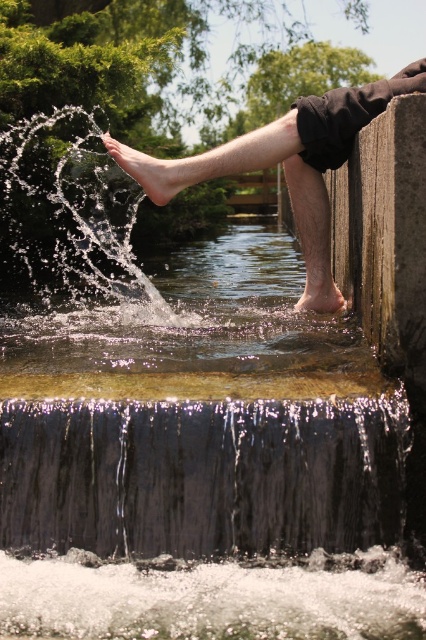
Question: Is shiny metallic waterfall at lower center above barefoot skin at upper center?

Choices:
 (A) no
 (B) yes

Answer: (A)

Question: Does barefoot skin at upper center appear over barefoot at center?

Choices:
 (A) no
 (B) yes

Answer: (B)

Question: Does barefoot skin at upper center come in front of barefoot at lower left?

Choices:
 (A) yes
 (B) no

Answer: (A)

Question: Considering the real-world distances, which object is closest to the barefoot at center?

Choices:
 (A) shiny metallic waterfall at lower center
 (B) barefoot at lower left
 (C) clear water at left

Answer: (B)

Question: Among these points, which one is farthest from the camera?

Choices:
 (A) (118, 433)
 (B) (71, 204)
 (C) (267, 147)
 (D) (132, 177)

Answer: (B)

Question: Which point is farther to the camera?

Choices:
 (A) (31, 481)
 (B) (48, 131)
 (C) (316, 289)

Answer: (B)